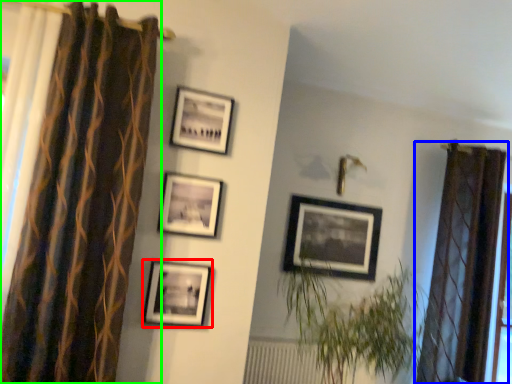
Question: Which object is positioned farthest from picture frame (highlighted by a red box)? Select from curtain (highlighted by a blue box) and curtain (highlighted by a green box).

Choices:
 (A) curtain
 (B) curtain

Answer: (A)